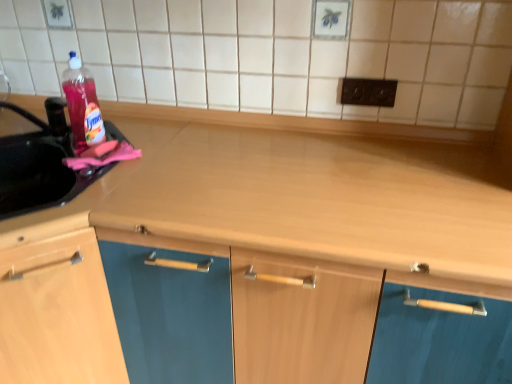
The image size is (512, 384). What do you see at coordinates (82, 106) in the screenshot? I see `translucent plastic bottle at left` at bounding box center [82, 106].

Where is `translucent plastic bottle at left`? This screenshot has height=384, width=512. translucent plastic bottle at left is located at coordinates (82, 106).

Identify the location of translucent plastic bottle at left. Image resolution: width=512 pixels, height=384 pixels. (82, 106).